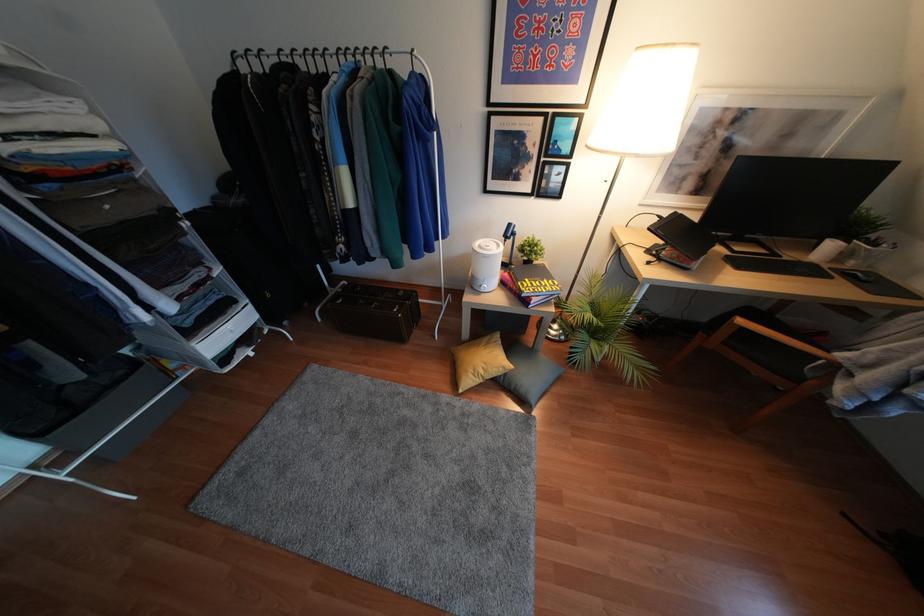
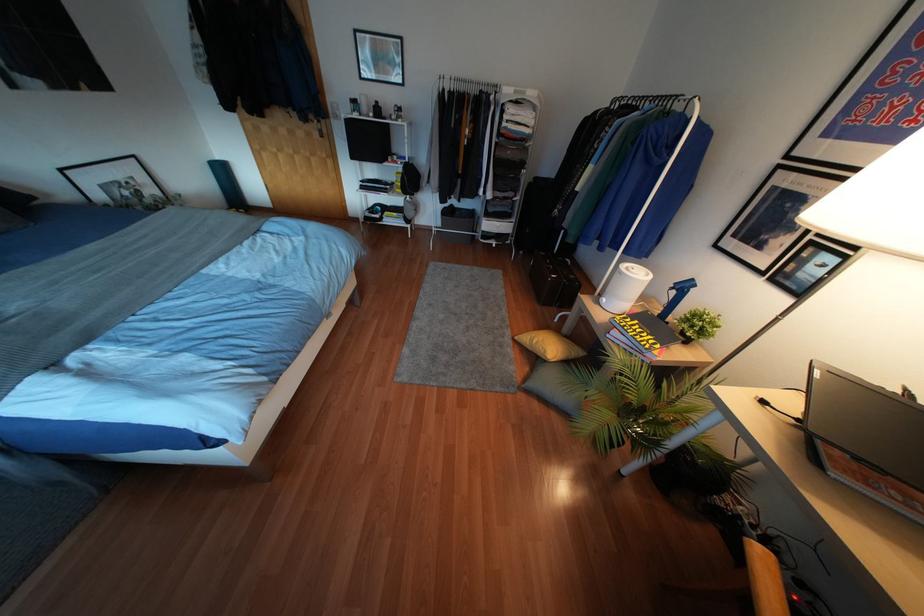
In the second image, find the point that corresponds to (508,224) in the first image.

(690, 280)